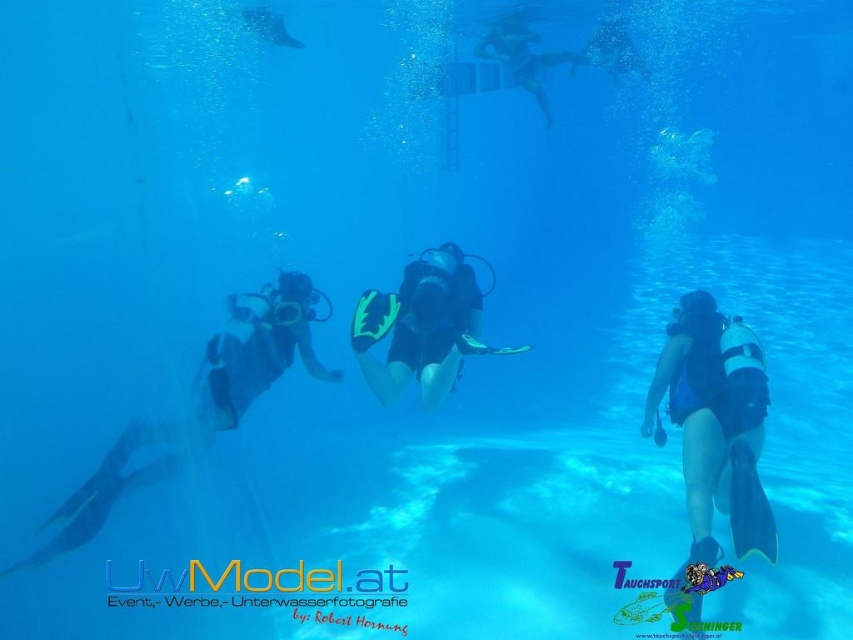
Question: Based on their relative distances, which object is nearer to the black matte scuba diver at center?

Choices:
 (A) blue matte wetsuit at lower right
 (B) black matte scuba gear at center

Answer: (B)

Question: Estimate the real-world distances between objects in this image. Which object is farther from the blue matte wetsuit at lower right?

Choices:
 (A) black matte scuba diver at center
 (B) black matte scuba gear at center

Answer: (A)

Question: Which point is closer to the camera?

Choices:
 (A) black matte scuba diver at center
 (B) blue matte wetsuit at lower right

Answer: (B)

Question: In this image, where is black matte scuba diver at center located relative to black matte scuba gear at center?

Choices:
 (A) left
 (B) right

Answer: (A)

Question: Is blue matte wetsuit at lower right to the left of black matte scuba gear at center from the viewer's perspective?

Choices:
 (A) yes
 (B) no

Answer: (B)

Question: Does blue matte wetsuit at lower right appear on the right side of black matte scuba diver at center?

Choices:
 (A) no
 (B) yes

Answer: (B)